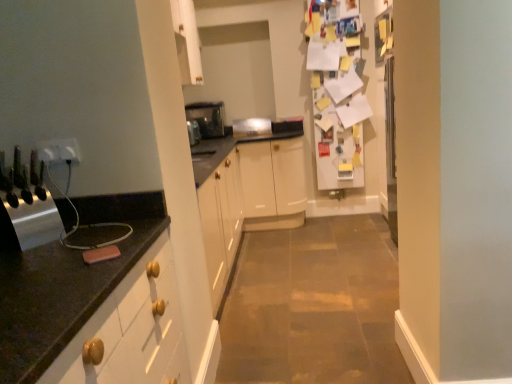
Question: Is white plastic outlet at left, the second electric outlet from the left, looking in the opposite direction of white plastic electric outlet at left, which is counted as the 2th electric outlet, starting from the right?

Choices:
 (A) no
 (B) yes

Answer: (B)

Question: Is white plastic outlet at left, which is the first electric outlet in right-to-left order, positioned in front of white plastic electric outlet at left, which is the 1th electric outlet in left-to-right order?

Choices:
 (A) yes
 (B) no

Answer: (B)

Question: From a real-world perspective, is white plastic outlet at left, which is the first electric outlet in right-to-left order, located beneath white plastic electric outlet at left, which is counted as the 2th electric outlet, starting from the right?

Choices:
 (A) no
 (B) yes

Answer: (A)

Question: Considering the relative sizes of white plastic outlet at left, the second electric outlet from the left, and white plastic electric outlet at left, which is the 1th electric outlet in left-to-right order, in the image provided, is white plastic outlet at left, the second electric outlet from the left, smaller than white plastic electric outlet at left, which is the 1th electric outlet in left-to-right order,?

Choices:
 (A) no
 (B) yes

Answer: (A)

Question: Is white plastic outlet at left, the second electric outlet from the left, behind white plastic electric outlet at left, which is counted as the 2th electric outlet, starting from the right?

Choices:
 (A) yes
 (B) no

Answer: (A)

Question: Is white plastic outlet at left, which is the first electric outlet in right-to-left order, bigger than white plastic electric outlet at left, which is counted as the 2th electric outlet, starting from the right?

Choices:
 (A) no
 (B) yes

Answer: (B)

Question: Is white paper covered fridge at upper right positioned behind metallic knife block at left, marked as the 4th appliance in a back-to-front arrangement?

Choices:
 (A) yes
 (B) no

Answer: (A)

Question: Is white paper covered fridge at upper right located outside metallic knife block at left, positioned as the 1th appliance in front-to-back order?

Choices:
 (A) yes
 (B) no

Answer: (A)

Question: Considering the relative sizes of white paper covered fridge at upper right and metallic knife block at left, acting as the 4th appliance starting from the top, in the image provided, is white paper covered fridge at upper right shorter than metallic knife block at left, acting as the 4th appliance starting from the top,?

Choices:
 (A) yes
 (B) no

Answer: (B)

Question: Does white paper covered fridge at upper right contain metallic knife block at left, marked as the 4th appliance in a back-to-front arrangement?

Choices:
 (A) yes
 (B) no

Answer: (B)

Question: Considering the relative positions of white paper covered fridge at upper right and metallic knife block at left, the first appliance in the bottom-to-top sequence, in the image provided, is white paper covered fridge at upper right to the right of metallic knife block at left, the first appliance in the bottom-to-top sequence, from the viewer's perspective?

Choices:
 (A) yes
 (B) no

Answer: (A)

Question: Could you tell me if white paper covered fridge at upper right is turned towards metallic knife block at left, positioned as the 1th appliance in front-to-back order?

Choices:
 (A) yes
 (B) no

Answer: (B)

Question: Can white plastic outlet at left, the second electric outlet from the left, be found inside satin silver toaster at center, acting as the third appliance starting from the front?

Choices:
 (A) yes
 (B) no

Answer: (B)